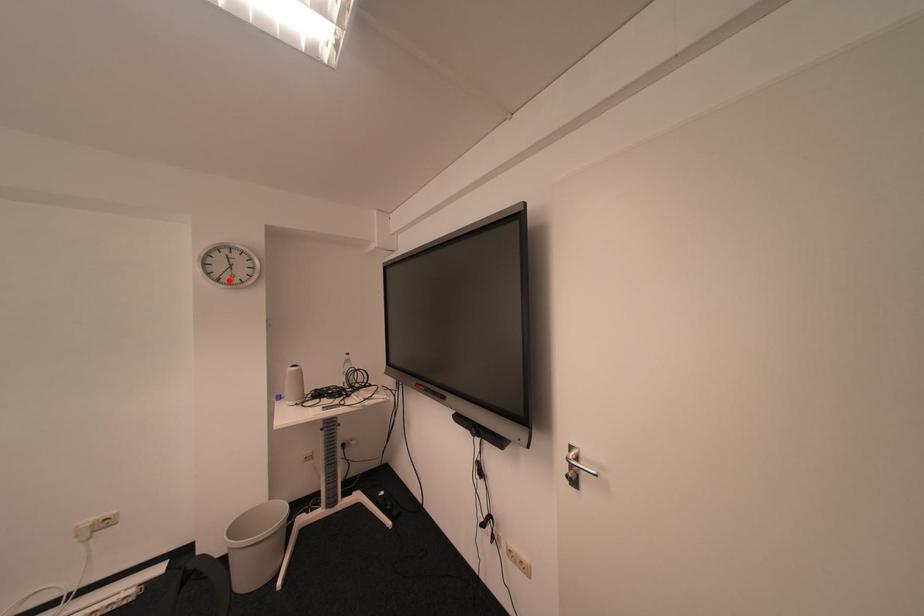
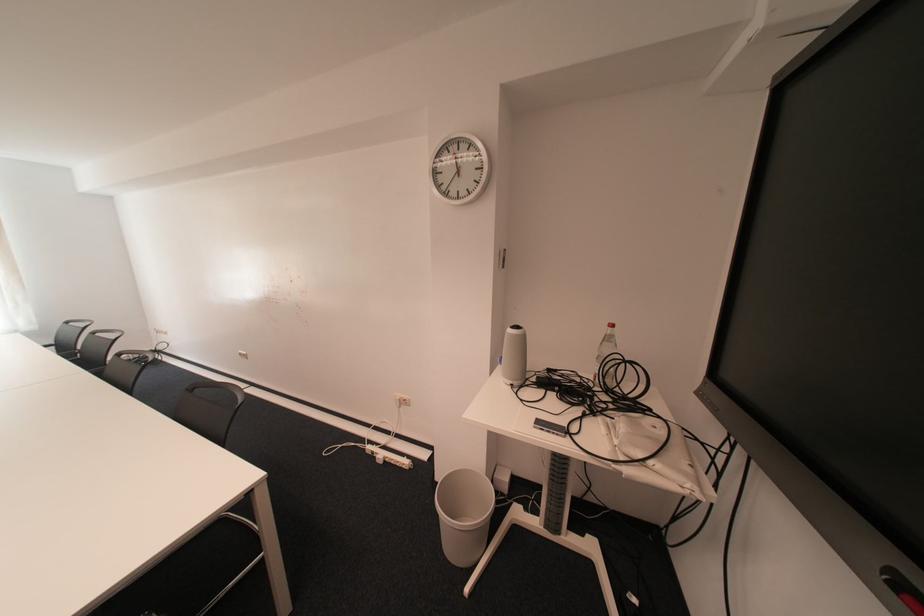
The point at the highlighted location is marked in the first image. Where is the corresponding point in the second image?

(457, 195)